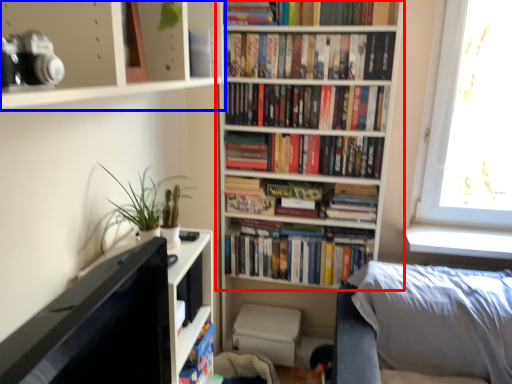
Question: Among these objects, which one is farthest to the camera, bookcase (highlighted by a red box) or shelf (highlighted by a blue box)?

Choices:
 (A) bookcase
 (B) shelf

Answer: (A)